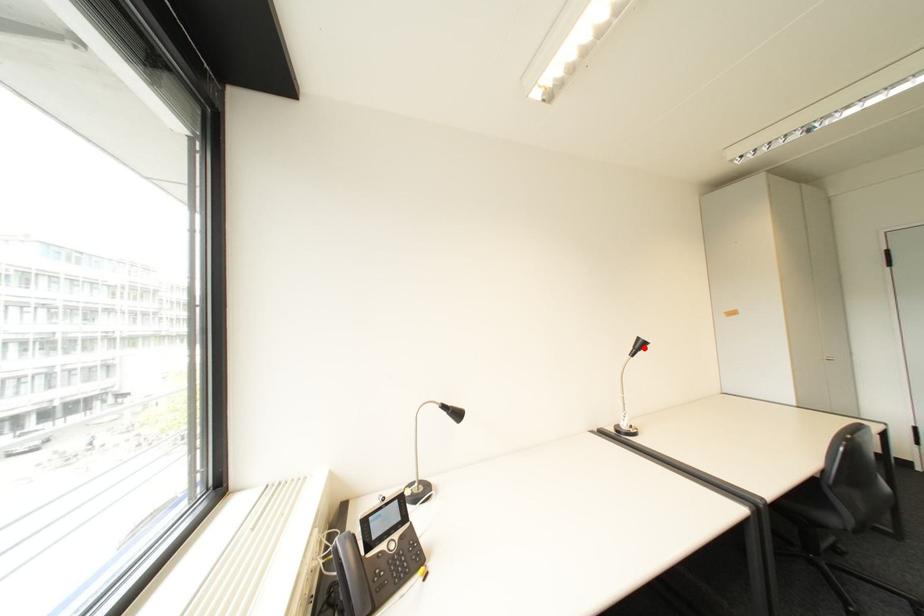
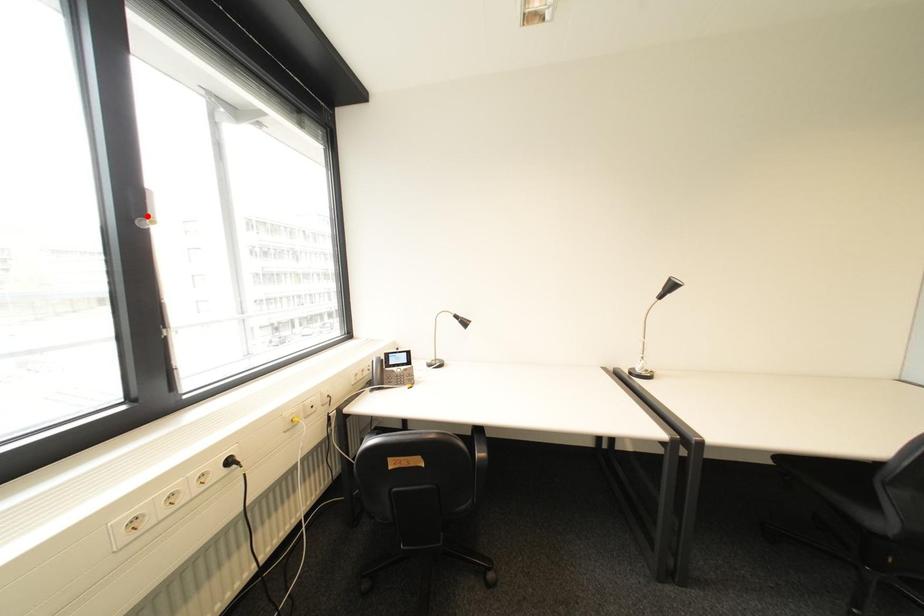
Looking at this image, I am providing you with two images of the same scene from different viewpoints. A red point is marked on the first image and another point is marked on the second image. Are the points marked in image1 and image2 representing the same 3D position?

No